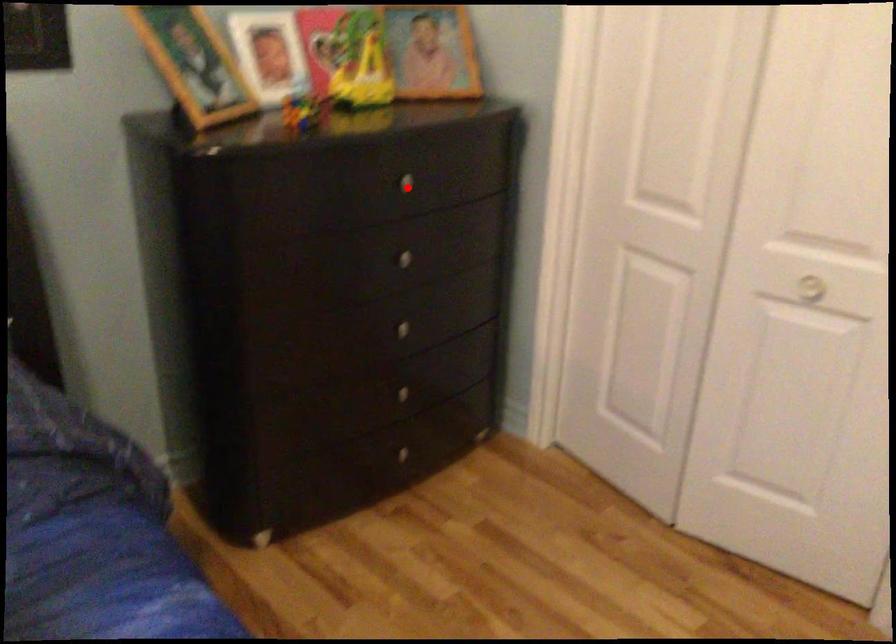
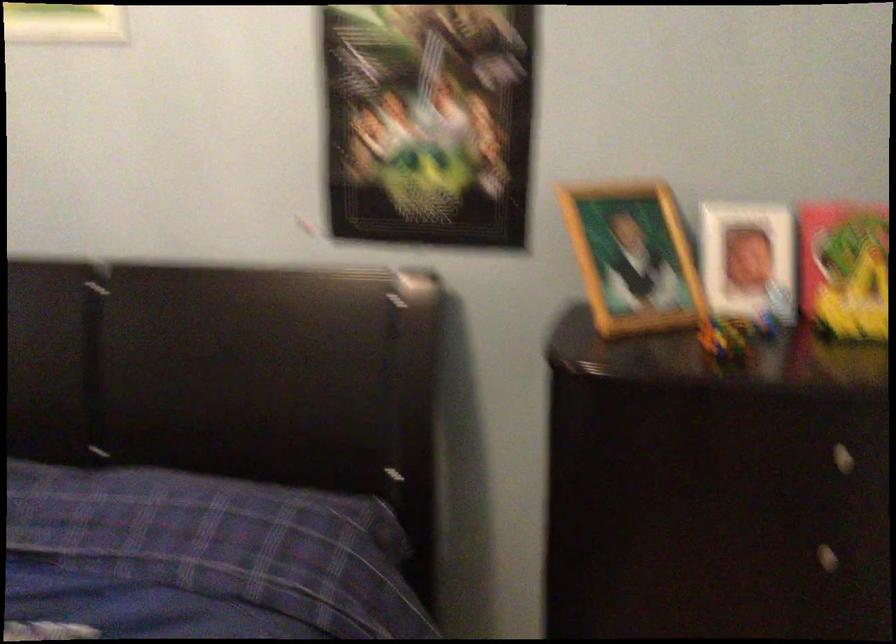
Question: I am providing you with two images of the same scene from different viewpoints. In image1, a red point is highlighted. Considering the same 3D point in image2, which of the following is correct?

Choices:
 (A) It is closer
 (B) It is farther

Answer: (A)